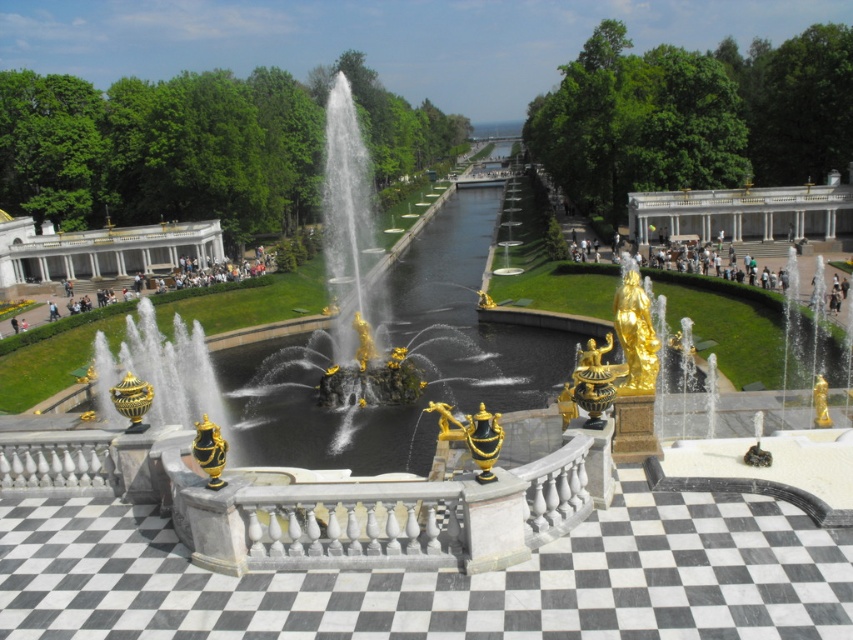
You are standing in the grand garden and want to reach the point marked at coordinates (498, 200). Given that the garden is surrounded by a stone balustrade in the foreground, how far will you have to walk to reach that specific point?

The point at coordinates (498, 200) is 501.44 feet away from the viewer, so you will have to walk 501.44 feet to reach it.

Looking at this image, you are standing at the entrance of the garden and want to locate the black polished water at center. According to the coordinates provided, where would you find it?

A: The black polished water at center is located at the coordinates point (440, 246).